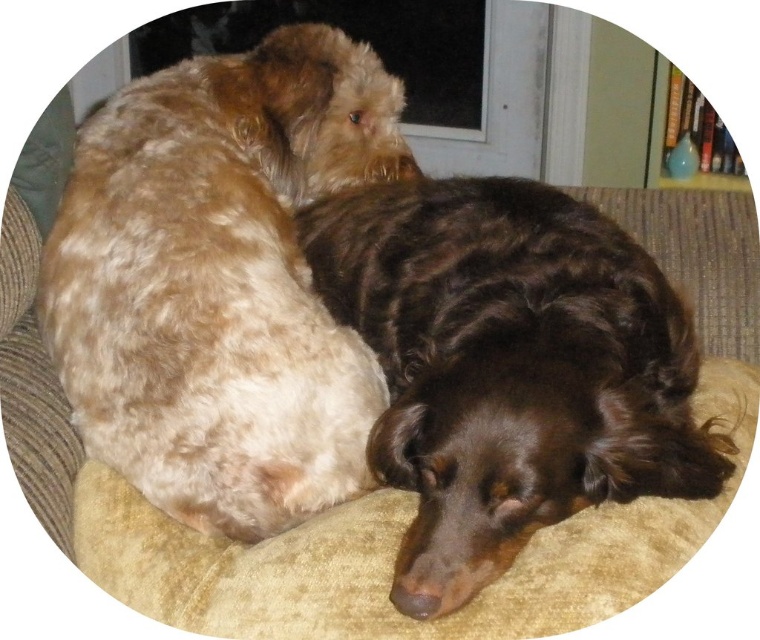
You are a photographer trying to capture a closeup of the brown shaggy dog at upper left. The camera you are using has a focal length of 50mm. If the point marking the dog is at coordinates (220,280), can you estimate whether this point is within the camera frame? Assume the camera frame is centered at 0.5, 0.5 with a width and height of 0.3 each.

The point (220,280) is within the camera frame centered at 0.5, 0.5 with a width and height of 0.3 each, so yes, the brown shaggy dog at upper left can be captured in the closeup.

You are a photographer standing at a certain distance from the dogs. You want to take a closeup shot of the brown shaggy dog at upper left without moving the camera. Is the current distance sufficient to capture the dog in focus?

The brown shaggy dog at upper left is 38.26 inches from camera, so if your camera can focus at that distance, it should be possible to take a closeup shot without moving the camera.

You are a dog owner who wants to place a new dog bed in your living room. You have a brown shaggy dog at upper left and a beige fabric dog bed at center. Which object is taller, and how does this affect the placement of the new bed?

The brown shaggy dog at upper left is taller than the beige fabric dog bed at center. This means the new bed should be placed where it accommodates the dog comfortably, considering its height, perhaps ensuring there is enough space around it for the dog to move without obstruction.